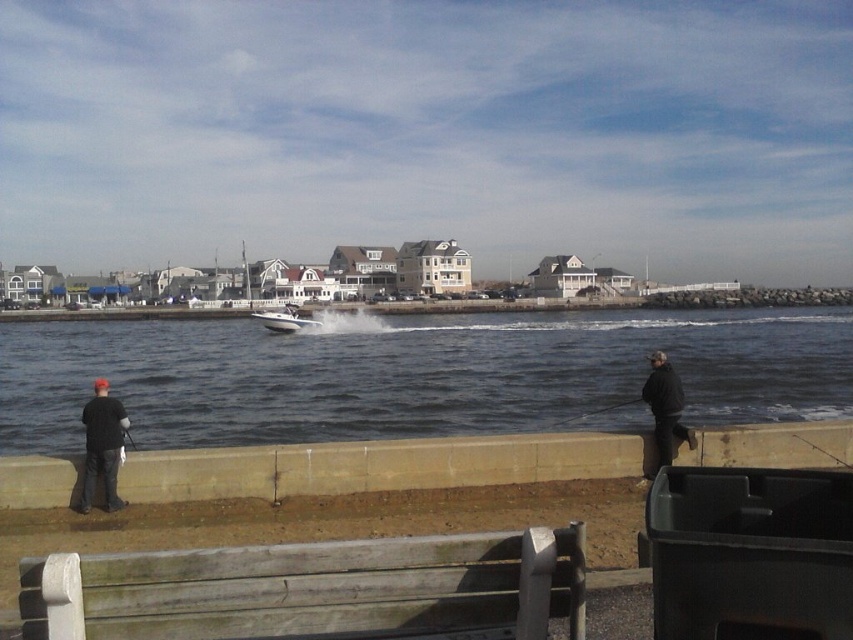
Looking at this image, you are a photographer taking a picture of the coastal scene. You notice two people wearing black jackets, one labeled as the matte black jacket at left and the other as the black matte jacket at lower right. Which of these two jackets is positioned more to the left in the image?

The matte black jacket at left is positioned more to the left compared to the black matte jacket at lower right.

You are standing on the concrete barrier and want to move to the boat in the middle of the water. Which object do you need to pass first, the dark blue water at center or the matte black jacket at left?

The matte black jacket at left is on the left side of the dark blue water at center, so you must pass the matte black jacket at left first before reaching the dark blue water at center.